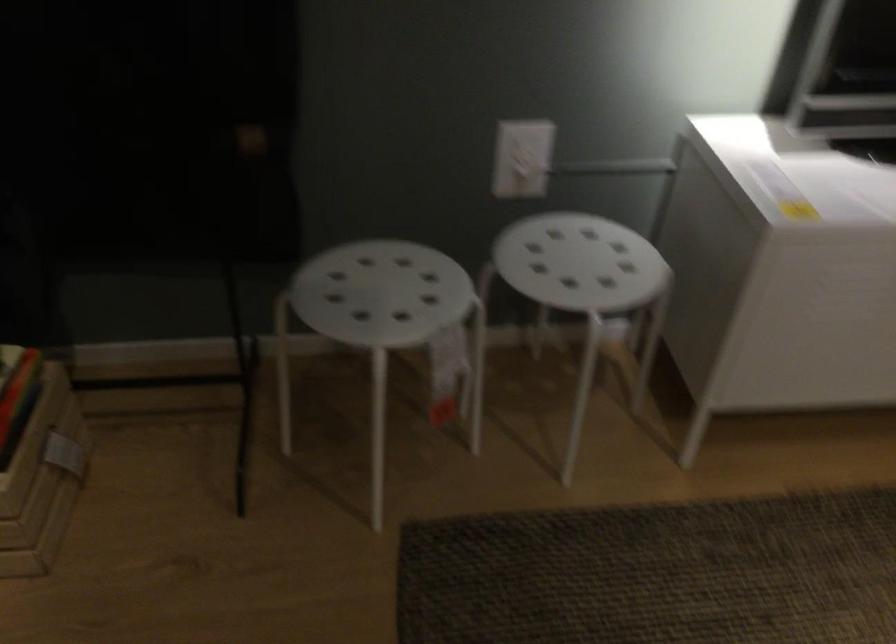
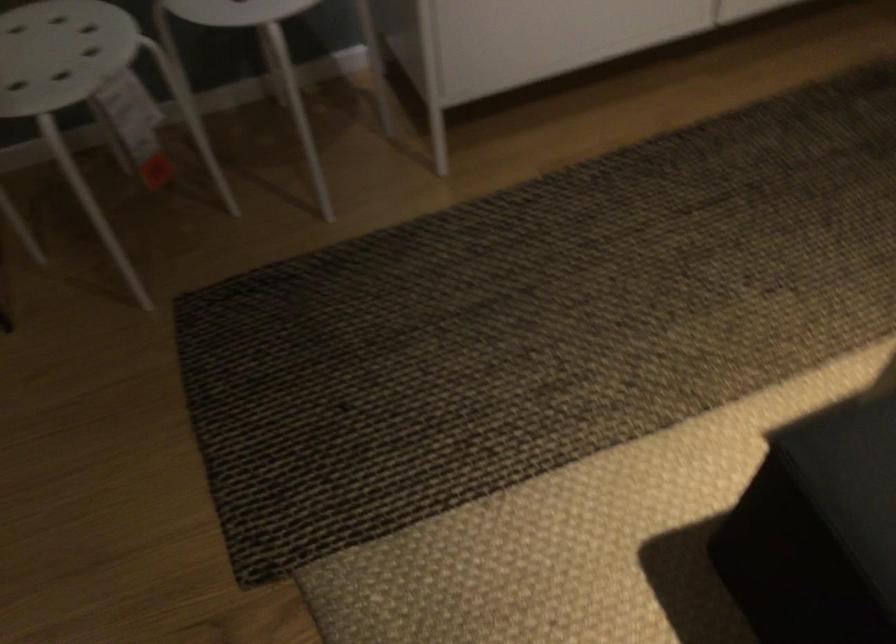
Question: The images are taken continuously from a first-person perspective. In which direction are you moving?

Choices:
 (A) Left
 (B) Right
 (C) Forward
 (D) Backward

Answer: (B)